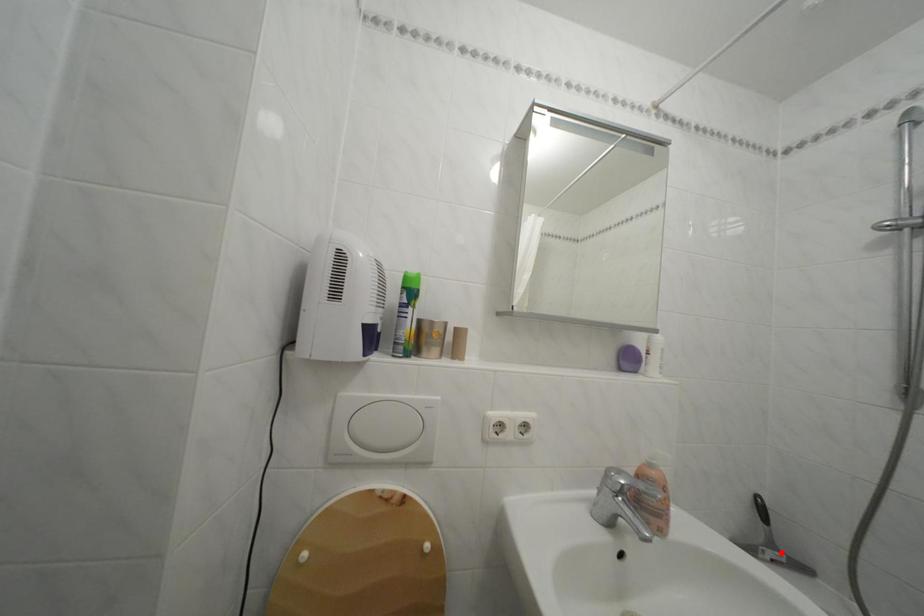
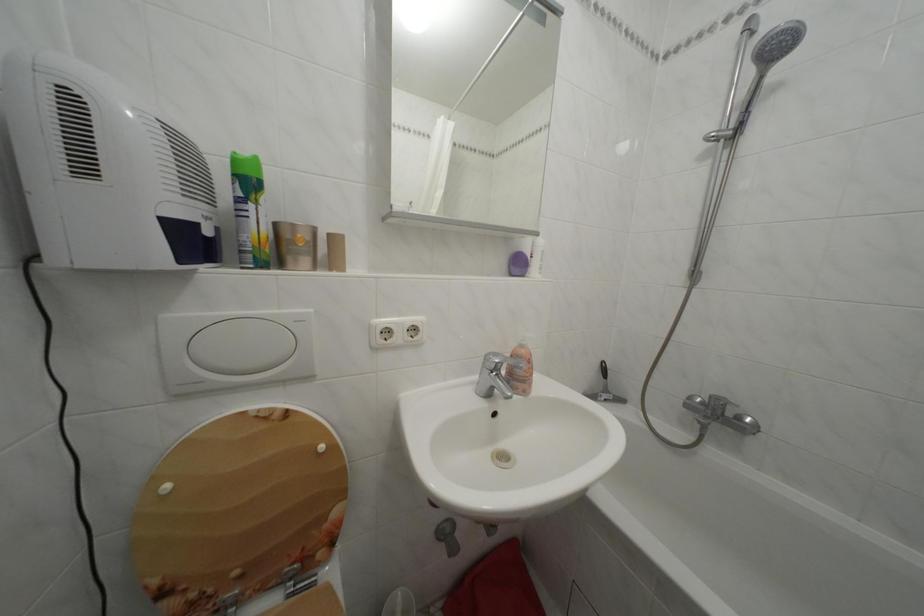
Question: I am providing you with two images of the same scene from different viewpoints. Image1 has a red point marked. In image2, the corresponding 3D location appears at what relative position? Reply with the corresponding letter.

Choices:
 (A) Closer
 (B) Farther

Answer: (B)